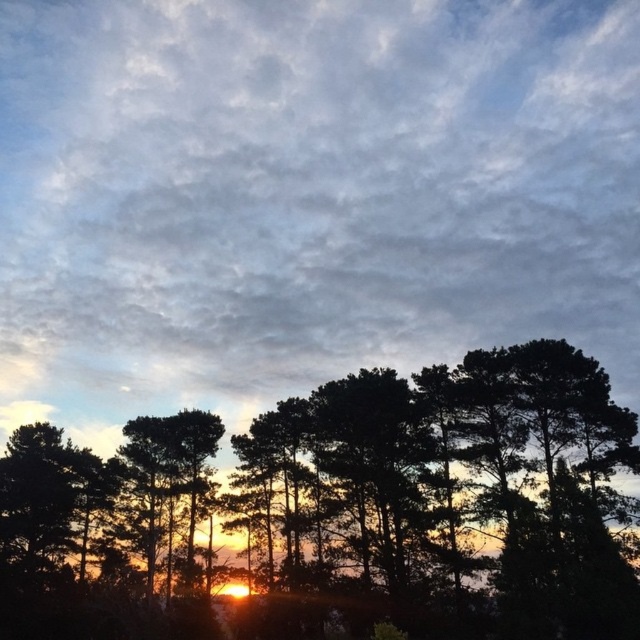
Does cloudy sky at upper center have a lesser width compared to black matte tree at center?

No.

This screenshot has height=640, width=640. What do you see at coordinates (307, 195) in the screenshot? I see `cloudy sky at upper center` at bounding box center [307, 195].

This screenshot has height=640, width=640. Find the location of `cloudy sky at upper center`. cloudy sky at upper center is located at coordinates (307, 195).